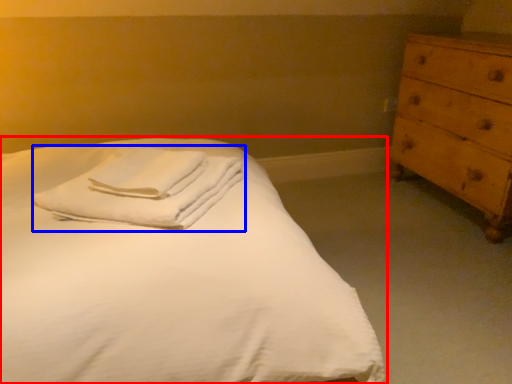
Question: Which object is further to the camera taking this photo, bed (highlighted by a red box) or material (highlighted by a blue box)?

Choices:
 (A) bed
 (B) material

Answer: (B)